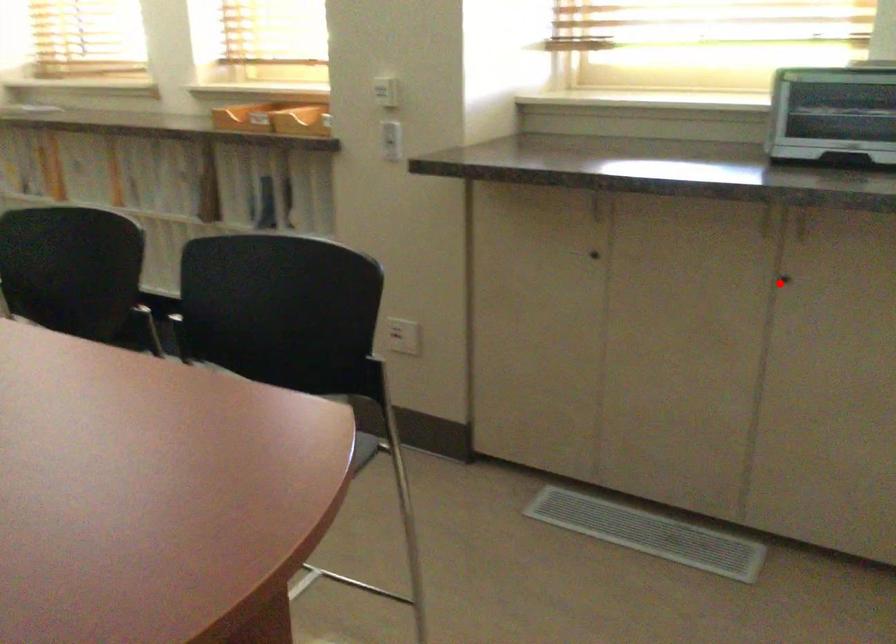
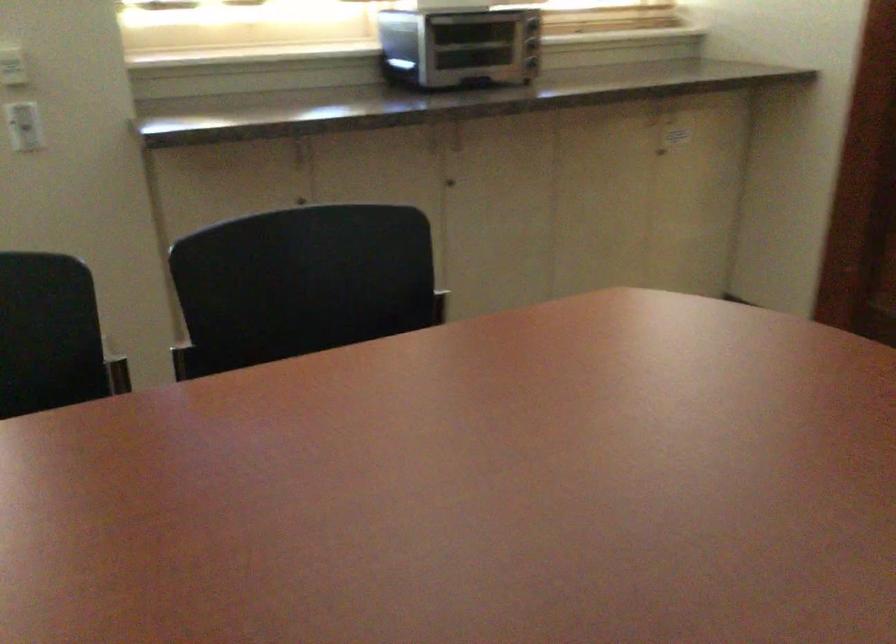
Locate, in the second image, the point that corresponds to the highlighted location in the first image.

(450, 183)